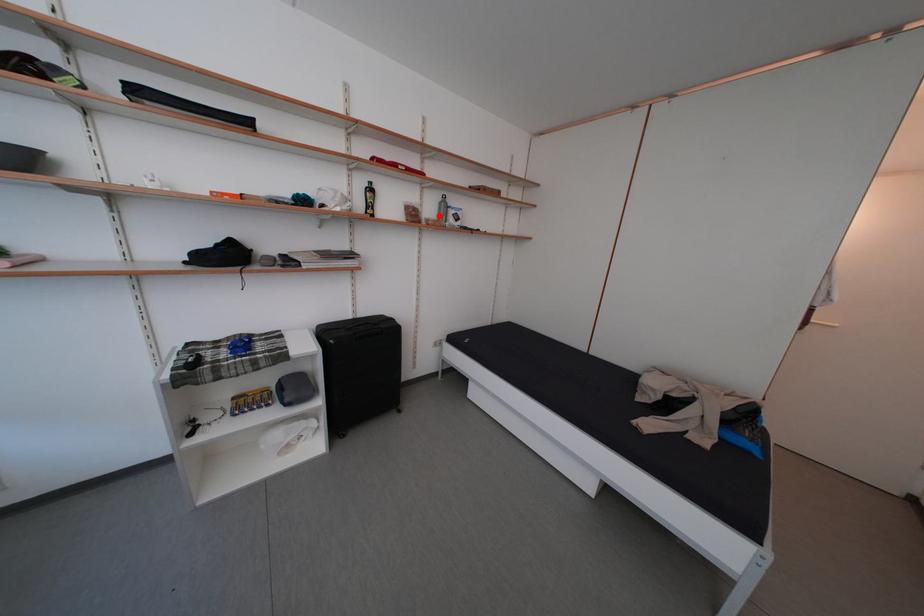
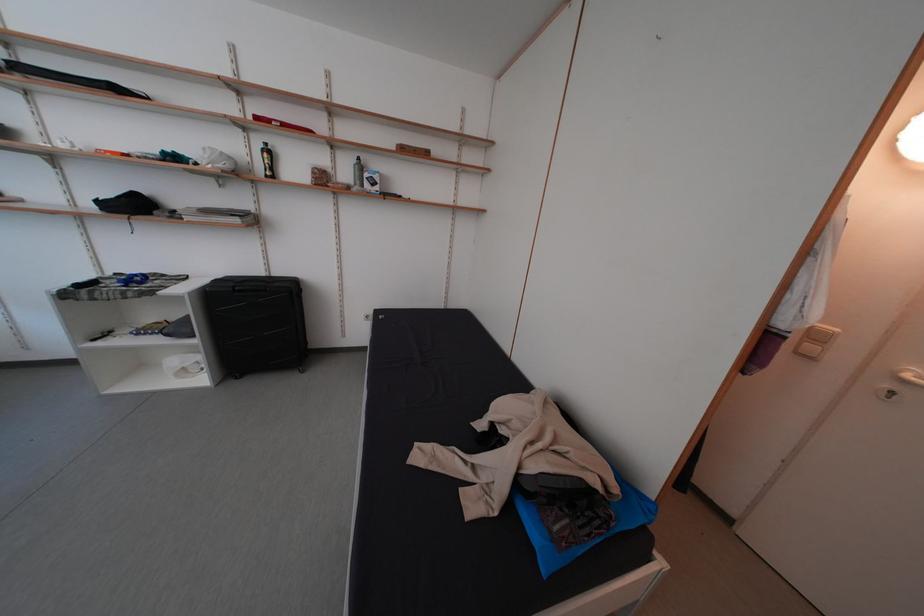
Find the pixel in the second image that matches the highlighted location in the first image.

(354, 179)